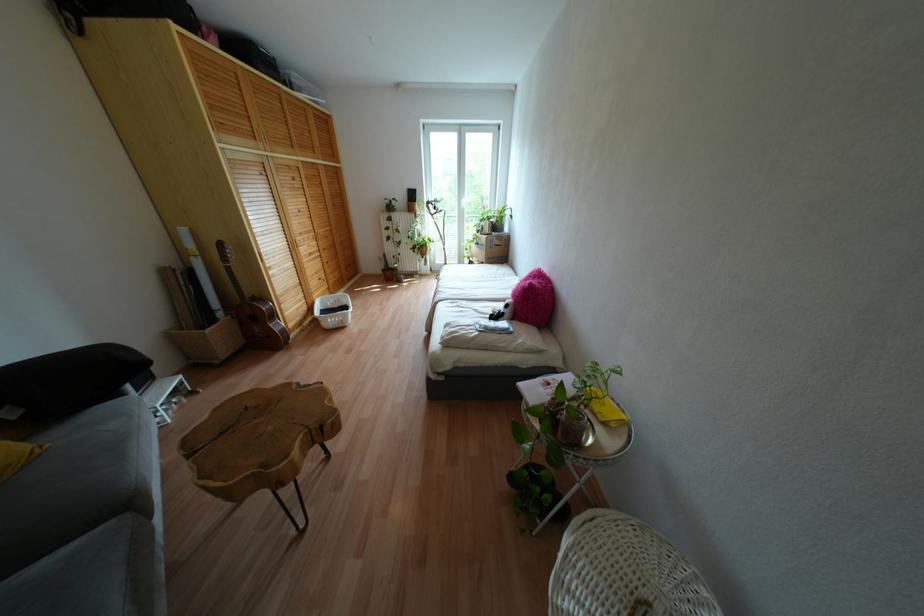
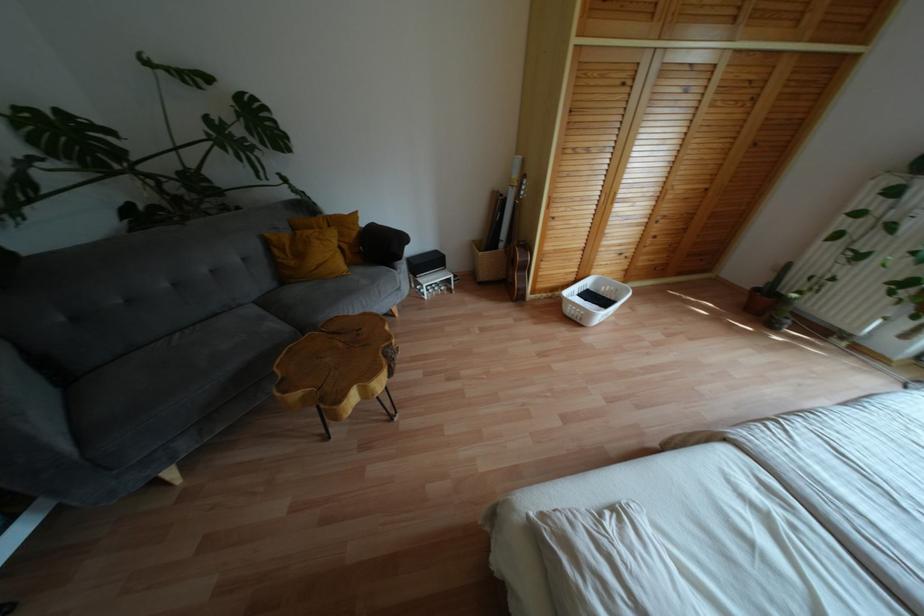
In the second image, find the point that corresponds to (x=254, y=421) in the first image.

(341, 344)